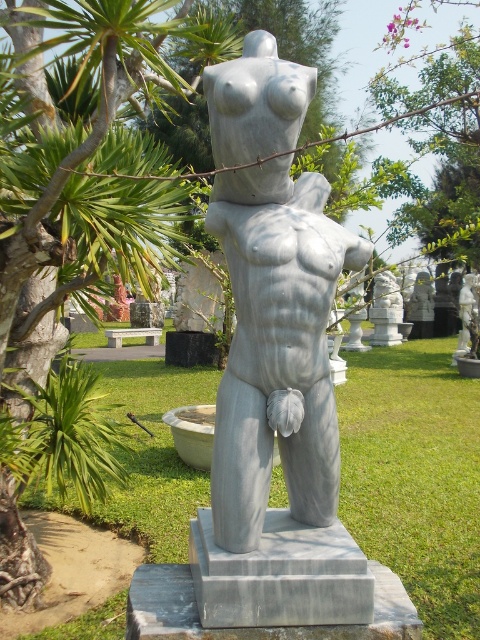
This screenshot has width=480, height=640. I want to click on green leafy tree at left, so click(76, 198).

Who is positioned more to the left, green leafy tree at left or white marble statue at center?

green leafy tree at left

Who is more forward, (8, 496) or (284, 131)?

Point (284, 131) is in front.

Locate an element on the screen. The width and height of the screenshot is (480, 640). green leafy tree at left is located at coordinates (76, 198).